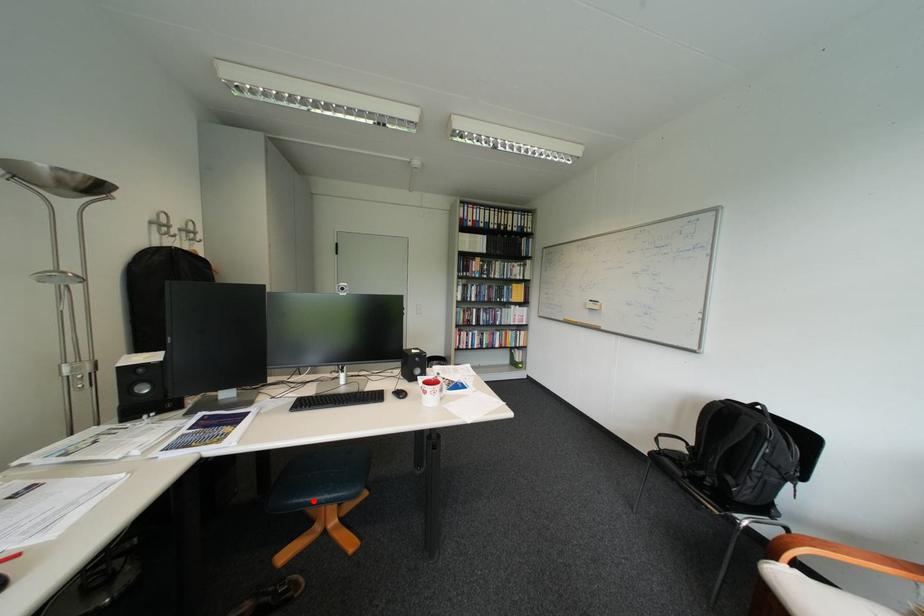
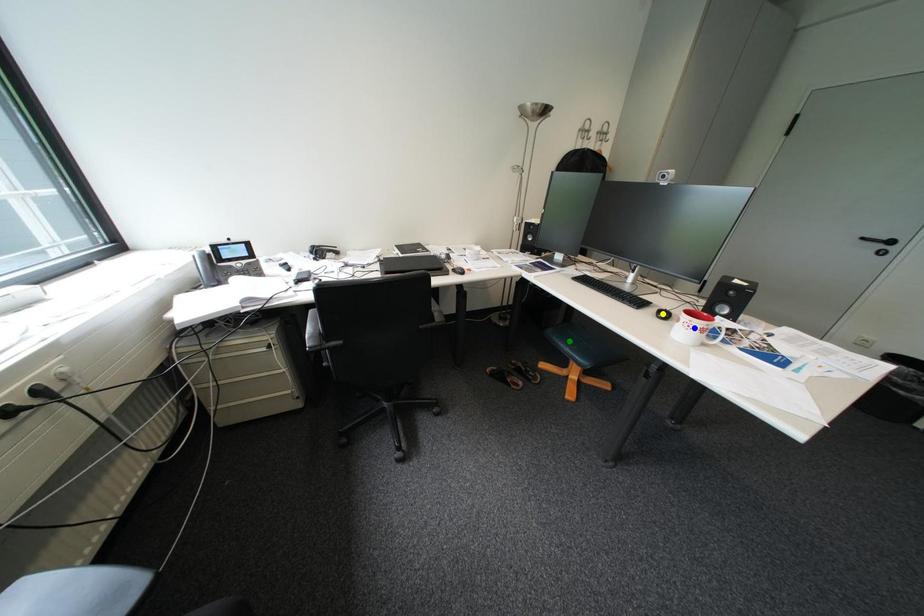
Question: I am providing you with two images of the same scene from different viewpoints. A red point is marked on the first image. You are given multiple points on the second image. Which mark in image 2 goes with the point in image 1?

Choices:
 (A) blue point
 (B) green point
 (C) yellow point

Answer: (B)